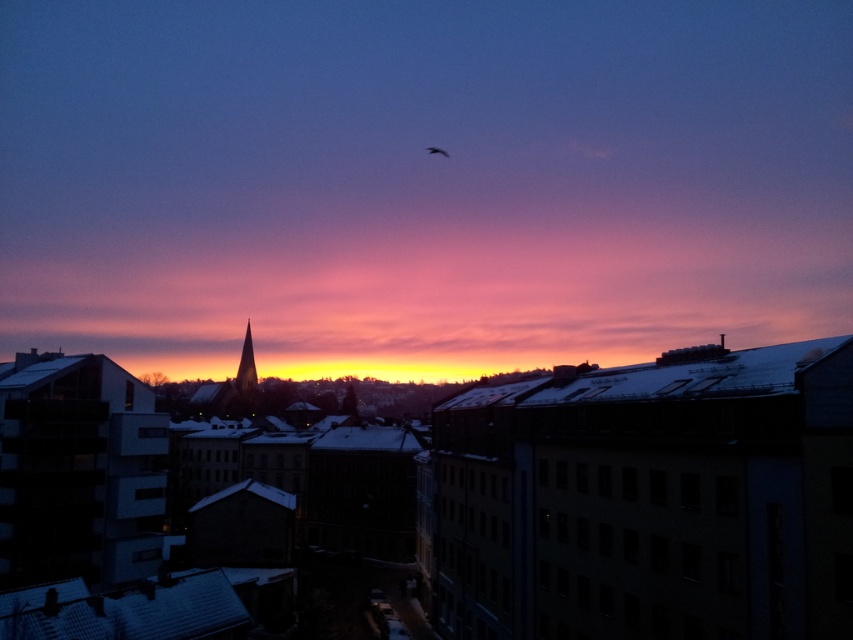
Question: Does golden glass spire at center have a lesser width compared to silvery metallic bird at upper center?

Choices:
 (A) no
 (B) yes

Answer: (A)

Question: Can you confirm if golden glass spire at center is positioned to the right of silvery metallic bird at upper center?

Choices:
 (A) no
 (B) yes

Answer: (A)

Question: Can you confirm if golden glass spire at center is positioned above silvery metallic bird at upper center?

Choices:
 (A) no
 (B) yes

Answer: (A)

Question: Which object is closer to the camera taking this photo?

Choices:
 (A) golden glass spire at center
 (B) silvery metallic bird at upper center

Answer: (A)